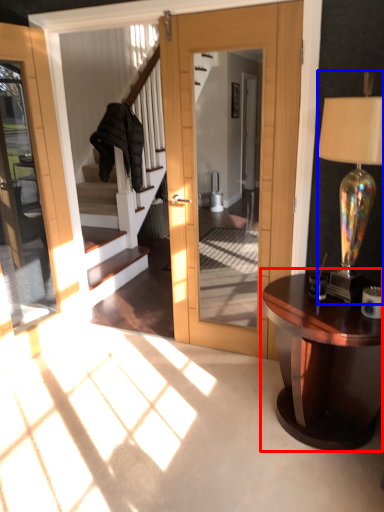
Question: Which object appears closest to the camera in this image, table (highlighted by a red box) or lamp (highlighted by a blue box)?

Choices:
 (A) table
 (B) lamp

Answer: (B)